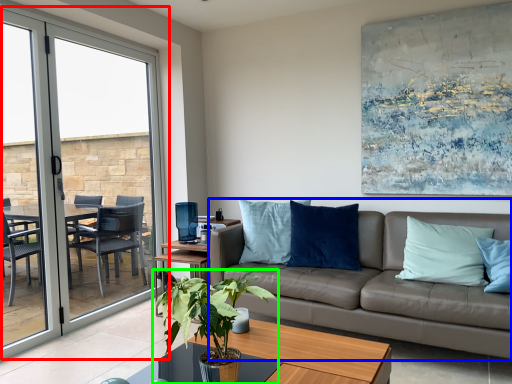
Question: Which object is positioned farthest from window (highlighted by a red box)? Select from studio couch (highlighted by a blue box) and houseplant (highlighted by a green box).

Choices:
 (A) studio couch
 (B) houseplant

Answer: (B)